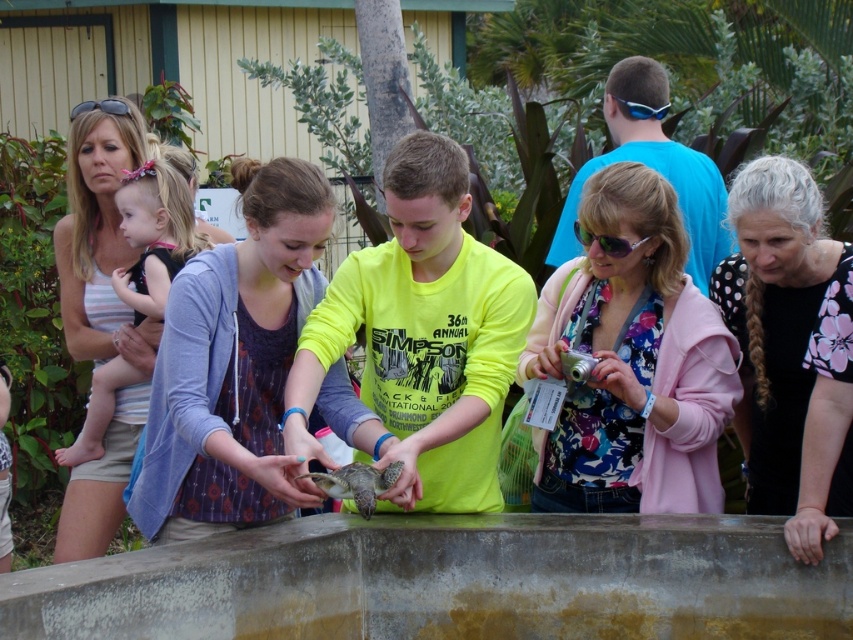
Question: Does neon yellow shirt at center have a greater width compared to smooth green turtle at center?

Choices:
 (A) no
 (B) yes

Answer: (B)

Question: From the image, what is the correct spatial relationship of concrete ledge at center in relation to sunglasses at center?

Choices:
 (A) above
 (B) below

Answer: (B)

Question: Is matte purple dress at center to the left of neon yellow shirt at center from the viewer's perspective?

Choices:
 (A) no
 (B) yes

Answer: (B)

Question: Among these objects, which one is farthest from the camera?

Choices:
 (A) sunglasses at center
 (B) concrete ledge at center
 (C) neon yellow shirt at center
 (D) smooth green turtle at center

Answer: (A)

Question: Which object is positioned closest to the sunglasses at center?

Choices:
 (A) matte pink dress at left
 (B) floral fabric shirt at center
 (C) concrete ledge at center
 (D) blue plastic goggles at upper center

Answer: (B)

Question: Considering the real-world distances, which object is closest to the blue plastic goggles at upper center?

Choices:
 (A) concrete ledge at center
 (B) black plastic sunglasses at upper left
 (C) black floral shirt at right

Answer: (C)